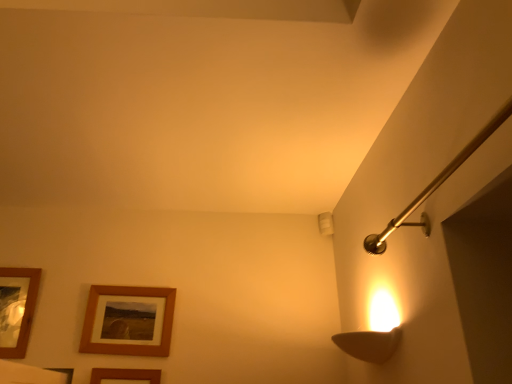
Image resolution: width=512 pixels, height=384 pixels. What do you see at coordinates (127, 339) in the screenshot? I see `woodenobject at lower left, placed as the 2th picture frame when sorted from left to right` at bounding box center [127, 339].

The height and width of the screenshot is (384, 512). I want to click on wooden framed picture at lower left, placed as the first picture frame when sorted from left to right, so coord(17,309).

Is wooden framed picture at lower left, placed as the first picture frame when sorted from left to right, shorter than woodenobject at lower left, placed as the 2th picture frame when sorted from left to right?

No, wooden framed picture at lower left, placed as the first picture frame when sorted from left to right, is not shorter than woodenobject at lower left, placed as the 2th picture frame when sorted from left to right.

How many degrees apart are the facing directions of wooden framed picture at lower left, placed as the first picture frame when sorted from left to right, and woodenobject at lower left, placed as the 2th picture frame when sorted from left to right?

1.33 degrees separate the facing orientations of wooden framed picture at lower left, placed as the first picture frame when sorted from left to right, and woodenobject at lower left, placed as the 2th picture frame when sorted from left to right.

Is wooden framed picture at lower left, placed as the first picture frame when sorted from left to right, not close to woodenobject at lower left, placed as the 2th picture frame when sorted from left to right?

Actually, wooden framed picture at lower left, placed as the first picture frame when sorted from left to right, and woodenobject at lower left, placed as the 2th picture frame when sorted from left to right, are a little close together.

Is wooden framed picture at lower left, which ranks as the 3th picture frame in right-to-left order, smaller than woodenobject at lower left, placed as the 2th picture frame when sorted from left to right?

Actually, wooden framed picture at lower left, which ranks as the 3th picture frame in right-to-left order, might be larger than woodenobject at lower left, placed as the 2th picture frame when sorted from left to right.

Is woodenobject at lower left, arranged as the second picture frame when viewed from the right, inside or outside of wooden framed picture at lower left, placed as the first picture frame when sorted from left to right?

woodenobject at lower left, arranged as the second picture frame when viewed from the right, cannot be found inside wooden framed picture at lower left, placed as the first picture frame when sorted from left to right.

Is woodenobject at lower left, arranged as the second picture frame when viewed from the right, turned away from wooden framed picture at lower left, which ranks as the 3th picture frame in right-to-left order?

No, woodenobject at lower left, arranged as the second picture frame when viewed from the right,'s orientation is not away from wooden framed picture at lower left, which ranks as the 3th picture frame in right-to-left order.

The image size is (512, 384). Find the location of `picture frame behind the wooden framed picture at lower left, placed as the first picture frame when sorted from left to right`. picture frame behind the wooden framed picture at lower left, placed as the first picture frame when sorted from left to right is located at coordinates (127, 339).

From the image's perspective, relative to wooden framed picture at lower left, placed as the first picture frame when sorted from left to right, is woodenobject at lower left, placed as the 2th picture frame when sorted from left to right, above or below?

woodenobject at lower left, placed as the 2th picture frame when sorted from left to right, is situated lower than wooden framed picture at lower left, placed as the first picture frame when sorted from left to right, in the image.

Which is closer, (93, 382) or (102, 313)?

Point (93, 382) is positioned closer to the camera compared to point (102, 313).

From the image's perspective, is brown wooden picture frame at lower left, which appears as the first picture frame when viewed from the right, under woodenobject at lower left, arranged as the second picture frame when viewed from the right?

Indeed, from the image's perspective, brown wooden picture frame at lower left, which appears as the first picture frame when viewed from the right, is shown beneath woodenobject at lower left, arranged as the second picture frame when viewed from the right.

Considering the positions of objects brown wooden picture frame at lower left, marked as the third picture frame in a left-to-right arrangement, and wooden framed picture at lower left, placed as the first picture frame when sorted from left to right, in the image provided, who is in front, brown wooden picture frame at lower left, marked as the third picture frame in a left-to-right arrangement, or wooden framed picture at lower left, placed as the first picture frame when sorted from left to right,?

brown wooden picture frame at lower left, marked as the third picture frame in a left-to-right arrangement.

Between brown wooden picture frame at lower left, which appears as the first picture frame when viewed from the right, and wooden framed picture at lower left, which ranks as the 3th picture frame in right-to-left order, which one has smaller width?

brown wooden picture frame at lower left, which appears as the first picture frame when viewed from the right, is thinner.

Does brown wooden picture frame at lower left, marked as the third picture frame in a left-to-right arrangement, appear on the left side of wooden framed picture at lower left, placed as the first picture frame when sorted from left to right?

No.

From a real-world perspective, between brown wooden picture frame at lower left, marked as the third picture frame in a left-to-right arrangement, and wooden framed picture at lower left, which ranks as the 3th picture frame in right-to-left order, who is vertically higher?

From a 3D spatial view, wooden framed picture at lower left, which ranks as the 3th picture frame in right-to-left order, is above.

From a real-world perspective, does wooden framed picture at lower left, placed as the first picture frame when sorted from left to right, stand above brown wooden picture frame at lower left, marked as the third picture frame in a left-to-right arrangement?

Correct, in the physical world, wooden framed picture at lower left, placed as the first picture frame when sorted from left to right, is higher than brown wooden picture frame at lower left, marked as the third picture frame in a left-to-right arrangement.

From the picture: Considering the positions of objects wooden framed picture at lower left, which ranks as the 3th picture frame in right-to-left order, and brown wooden picture frame at lower left, marked as the third picture frame in a left-to-right arrangement, in the image provided, who is more to the right, wooden framed picture at lower left, which ranks as the 3th picture frame in right-to-left order, or brown wooden picture frame at lower left, marked as the third picture frame in a left-to-right arrangement,?

Positioned to the right is brown wooden picture frame at lower left, marked as the third picture frame in a left-to-right arrangement.

At what (x,y) coordinates should I click in order to perform the action: click on the 2nd picture frame above the brown wooden picture frame at lower left, which appears as the first picture frame when viewed from the right (from the image's perspective). Please return your answer as a coordinate pair (x, y). Looking at the image, I should click on pos(17,309).

Between point (6, 289) and point (144, 379), which one is positioned behind?

The point (6, 289) is farther.

Does woodenobject at lower left, arranged as the second picture frame when viewed from the right, have a lesser height compared to brown wooden picture frame at lower left, which appears as the first picture frame when viewed from the right?

Yes, woodenobject at lower left, arranged as the second picture frame when viewed from the right, is shorter than brown wooden picture frame at lower left, which appears as the first picture frame when viewed from the right.

Is brown wooden picture frame at lower left, which appears as the first picture frame when viewed from the right, at the back of woodenobject at lower left, arranged as the second picture frame when viewed from the right?

No, brown wooden picture frame at lower left, which appears as the first picture frame when viewed from the right, is not at the back of woodenobject at lower left, arranged as the second picture frame when viewed from the right.

Is woodenobject at lower left, placed as the 2th picture frame when sorted from left to right, next to brown wooden picture frame at lower left, marked as the third picture frame in a left-to-right arrangement, and touching it?

They are not placed beside each other.

Does woodenobject at lower left, placed as the 2th picture frame when sorted from left to right, have a smaller size compared to brown wooden picture frame at lower left, marked as the third picture frame in a left-to-right arrangement?

No, woodenobject at lower left, placed as the 2th picture frame when sorted from left to right, is not smaller than brown wooden picture frame at lower left, marked as the third picture frame in a left-to-right arrangement.

Find the location of a particular element. picture frame behind the wooden framed picture at lower left, which ranks as the 3th picture frame in right-to-left order is located at coordinates (127, 339).

You are a GUI agent. You are given a task and a screenshot of the screen. Output one action in this format:
    pyautogui.click(x=<x>, y=<y>)
    Task: Click on the picture frame on the left of woodenobject at lower left, arranged as the second picture frame when viewed from the right
    
    Given the screenshot: What is the action you would take?
    pyautogui.click(x=17, y=309)

Based on their spatial positions, is wooden framed picture at lower left, which ranks as the 3th picture frame in right-to-left order, or brown wooden picture frame at lower left, which appears as the first picture frame when viewed from the right, closer to woodenobject at lower left, placed as the 2th picture frame when sorted from left to right?

brown wooden picture frame at lower left, which appears as the first picture frame when viewed from the right.

Estimate the real-world distances between objects in this image. Which object is closer to wooden framed picture at lower left, placed as the first picture frame when sorted from left to right, brown wooden picture frame at lower left, marked as the third picture frame in a left-to-right arrangement, or woodenobject at lower left, arranged as the second picture frame when viewed from the right?

woodenobject at lower left, arranged as the second picture frame when viewed from the right, is positioned closer to the anchor wooden framed picture at lower left, placed as the first picture frame when sorted from left to right.

Looking at the image, which one is located closer to woodenobject at lower left, placed as the 2th picture frame when sorted from left to right, brown wooden picture frame at lower left, which appears as the first picture frame when viewed from the right, or wooden framed picture at lower left, which ranks as the 3th picture frame in right-to-left order?

brown wooden picture frame at lower left, which appears as the first picture frame when viewed from the right, is closer to woodenobject at lower left, placed as the 2th picture frame when sorted from left to right.

Considering their positions, is wooden framed picture at lower left, which ranks as the 3th picture frame in right-to-left order, positioned closer to brown wooden picture frame at lower left, marked as the third picture frame in a left-to-right arrangement, than woodenobject at lower left, placed as the 2th picture frame when sorted from left to right?

Based on the image, woodenobject at lower left, placed as the 2th picture frame when sorted from left to right, appears to be nearer to brown wooden picture frame at lower left, marked as the third picture frame in a left-to-right arrangement.

Based on their spatial positions, is woodenobject at lower left, arranged as the second picture frame when viewed from the right, or wooden framed picture at lower left, which ranks as the 3th picture frame in right-to-left order, further from brown wooden picture frame at lower left, which appears as the first picture frame when viewed from the right?

wooden framed picture at lower left, which ranks as the 3th picture frame in right-to-left order, is further to brown wooden picture frame at lower left, which appears as the first picture frame when viewed from the right.

From the picture: When comparing their distances from wooden framed picture at lower left, placed as the first picture frame when sorted from left to right, does woodenobject at lower left, placed as the 2th picture frame when sorted from left to right, or brown wooden picture frame at lower left, marked as the third picture frame in a left-to-right arrangement, seem closer?

woodenobject at lower left, placed as the 2th picture frame when sorted from left to right, is positioned closer to the anchor wooden framed picture at lower left, placed as the first picture frame when sorted from left to right.

The width and height of the screenshot is (512, 384). Identify the location of picture frame between wooden framed picture at lower left, placed as the first picture frame when sorted from left to right, and brown wooden picture frame at lower left, marked as the third picture frame in a left-to-right arrangement, in the horizontal direction. (127, 339).